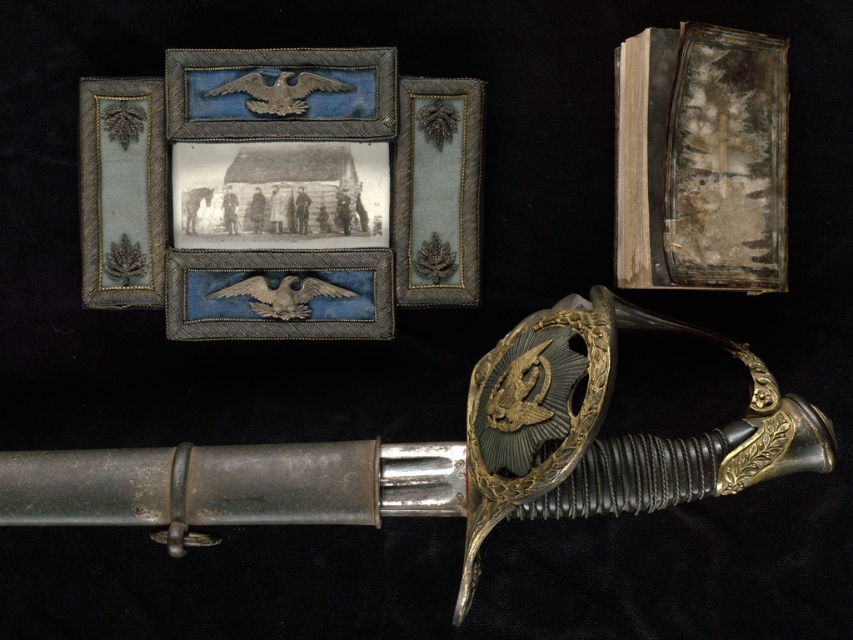
Does matte silver eagle at center have a larger size compared to distressed paper book at upper right?

Actually, matte silver eagle at center might be smaller than distressed paper book at upper right.

Is point (381, 326) positioned before point (704, 234)?

No, (381, 326) is further to viewer.

Between point (207, 104) and point (653, 76), which one is positioned behind?

Positioned behind is point (207, 104).

I want to click on matte silver eagle at center, so click(280, 193).

Image resolution: width=853 pixels, height=640 pixels. What do you see at coordinates (447, 452) in the screenshot? I see `polished silver sword at center` at bounding box center [447, 452].

Identify the location of polished silver sword at center. This screenshot has height=640, width=853. (447, 452).

At what (x,y) coordinates should I click in order to perform the action: click on polished silver sword at center. Please return your answer as a coordinate pair (x, y). This screenshot has width=853, height=640. Looking at the image, I should click on click(447, 452).

Who is taller, polished silver sword at center or silver textured eagle at center?

Standing taller between the two is polished silver sword at center.

Can you confirm if polished silver sword at center is shorter than silver textured eagle at center?

Incorrect, polished silver sword at center's height does not fall short of silver textured eagle at center's.

Measure the distance between point [590,292] and camera.

The distance of point [590,292] from camera is 3.89 feet.

At what (x,y) coordinates should I click in order to perform the action: click on polished silver sword at center. Please return your answer as a coordinate pair (x, y). Looking at the image, I should click on (447, 452).